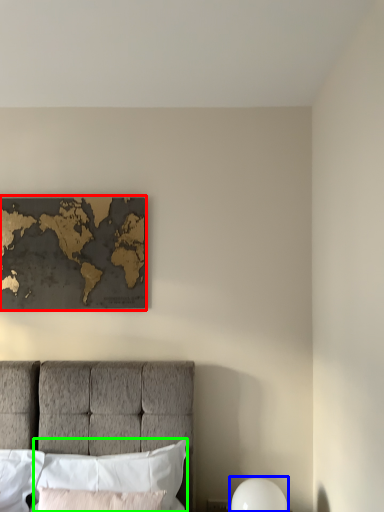
Question: Based on their relative distances, which object is nearer to picture frame (highlighted by a red box)? Choose from bedside lamp (highlighted by a blue box) and pillow (highlighted by a green box).

Choices:
 (A) bedside lamp
 (B) pillow

Answer: (B)